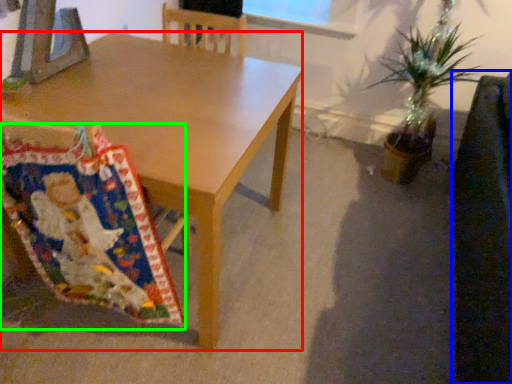
Question: Estimate the real-world distances between objects in this image. Which object is closer to desk (highlighted by a red box), swivel chair (highlighted by a blue box) or blanket (highlighted by a green box)?

Choices:
 (A) swivel chair
 (B) blanket

Answer: (B)